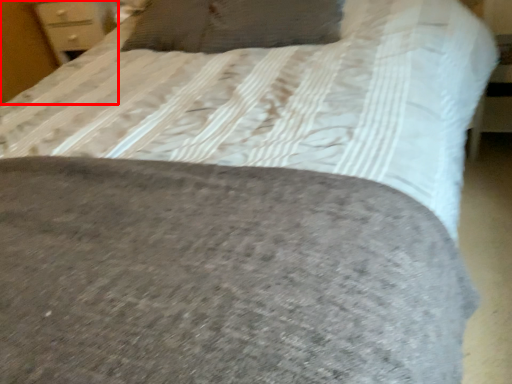
Question: From the image's perspective, considering the relative positions of dresser (annotated by the red box) and pillow in the image provided, where is dresser (annotated by the red box) located with respect to the staircase?

Choices:
 (A) above
 (B) below

Answer: (A)